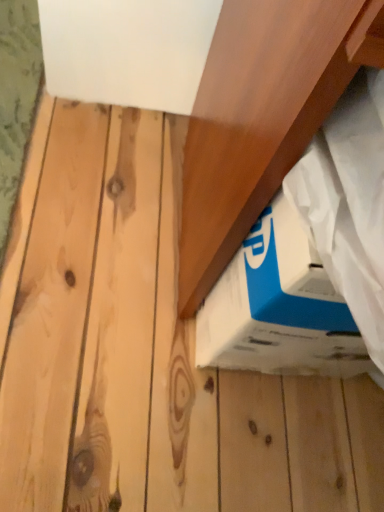
This screenshot has width=384, height=512. Find the location of `free space in front of wooden at upper right`. free space in front of wooden at upper right is located at coordinates (188, 409).